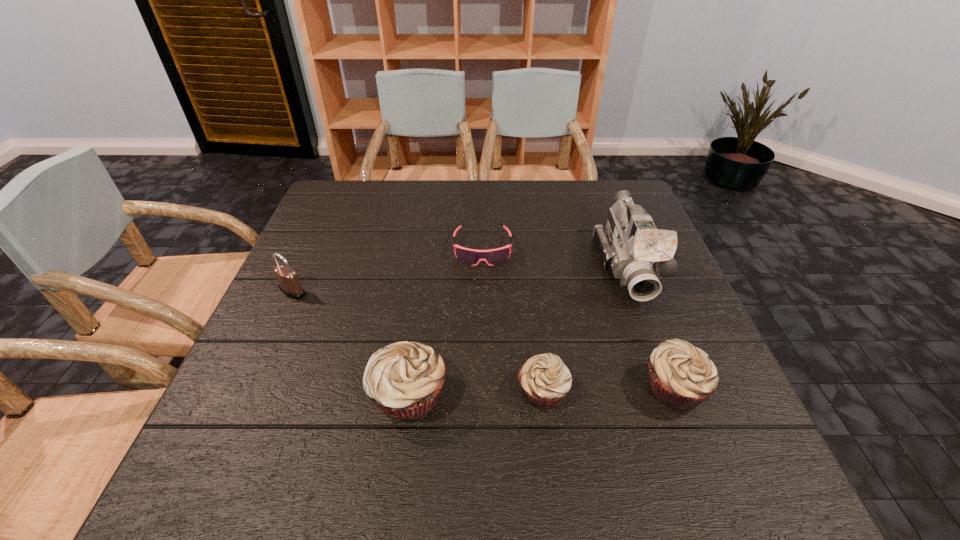
In the current image, all muffins are evenly spaced. To maintain this equal spacing, where should an additional muffin be placed on the left? Please point out a free spot. Please provide its 2D coordinates. Your answer should be formatted as a tuple, i.e. [(x, y)], where the tuple contains the x and y coordinates of a point satisfying the conditions above.

[(273, 399)]